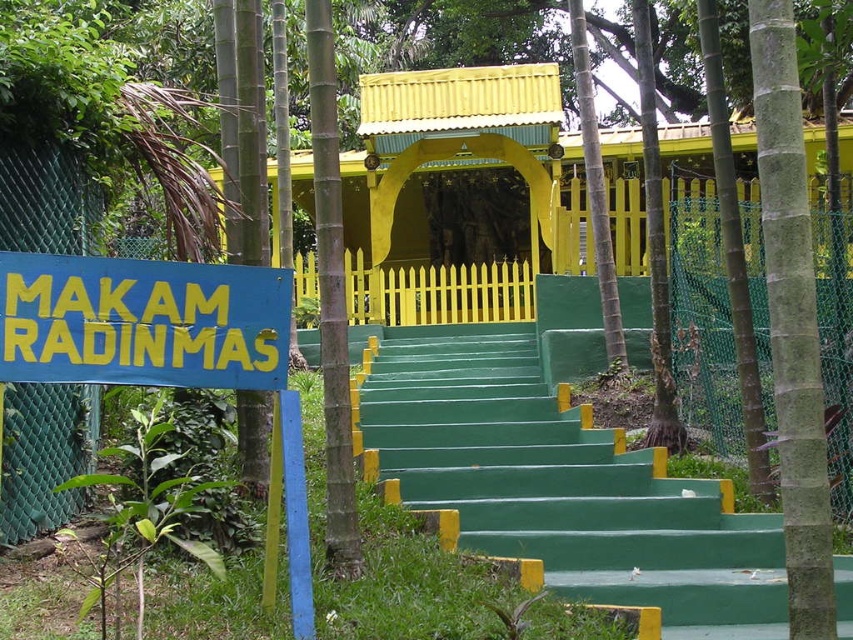
You are standing at the bottom of the green painted stairs at center and want to read the text on the blue painted signboard at left. Can you see the entire text clearly without moving your position?

The blue painted signboard at left is behind the green painted stairs at center, so you cannot see the entire text clearly without moving your position.

Consider the image. You are standing at the base of the green steps leading to the yellow pavilion in the scene. You notice two points marked in the image. Which point, point [602,486] or point [236,346], is closer to you?

Point [602,486] is further to the viewer than point [236,346], so the closer point is point [236,346].